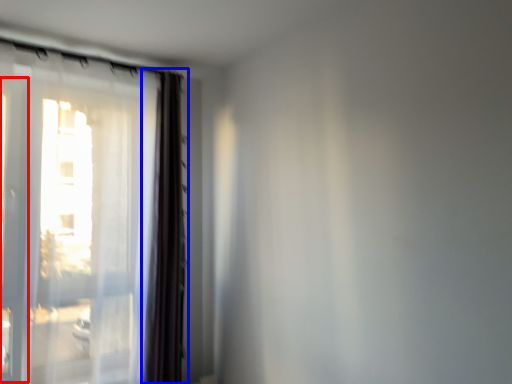
Question: Which object is further to the camera taking this photo, screen door (highlighted by a red box) or curtain (highlighted by a blue box)?

Choices:
 (A) screen door
 (B) curtain

Answer: (B)